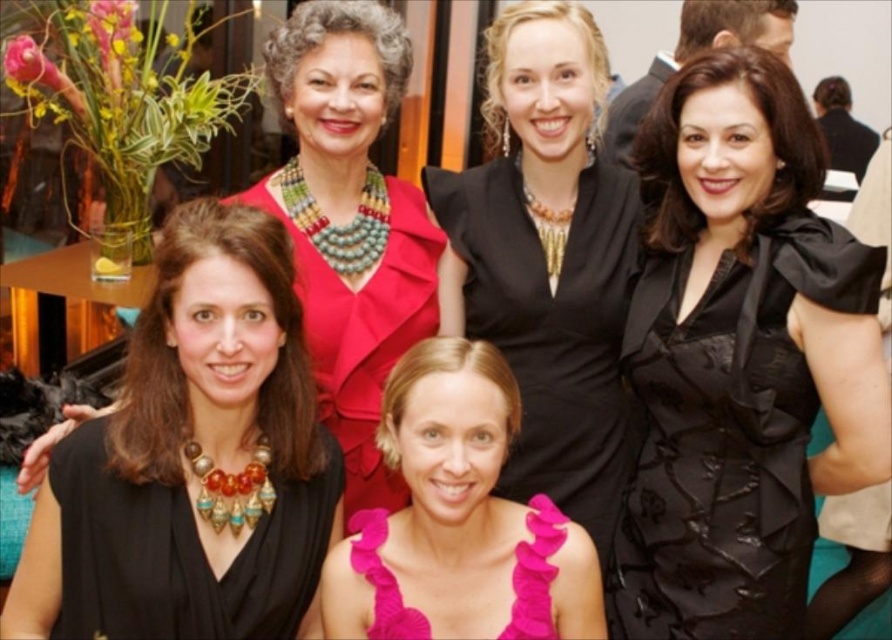
Where is the matte black dress at center located in the image?

The matte black dress at center is located at point [350,221].

You are a photographer trying to capture a clear shot of the black satin dress at center and the black satin dress at upper center. Since both dresses are black, how can you distinguish which one is closer to the camera?

The black satin dress at center is in front of the black satin dress at upper center, so it appears closer to the camera.

You are a photographer trying to capture a closeup of both the shiny red dress at center and the fuchsia textured fabric dress at center. Since you can only focus on one dress at a time, which dress should you choose to ensure the other remains in the background but still visible?

The shiny red dress at center is larger than the fuchsia textured fabric dress at center, so focusing on the shiny red dress at center would keep the smaller fuchsia textured fabric dress at center in the background while still visible.